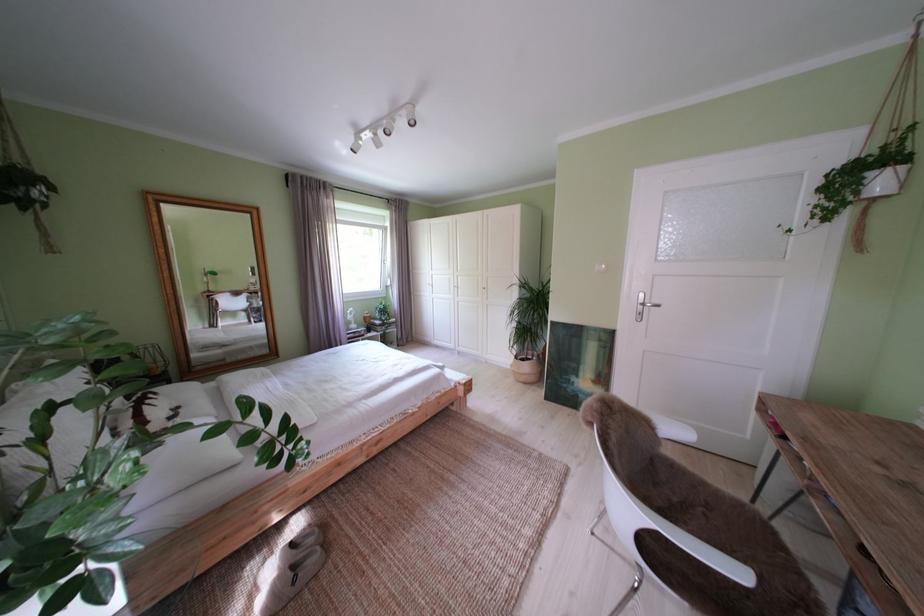
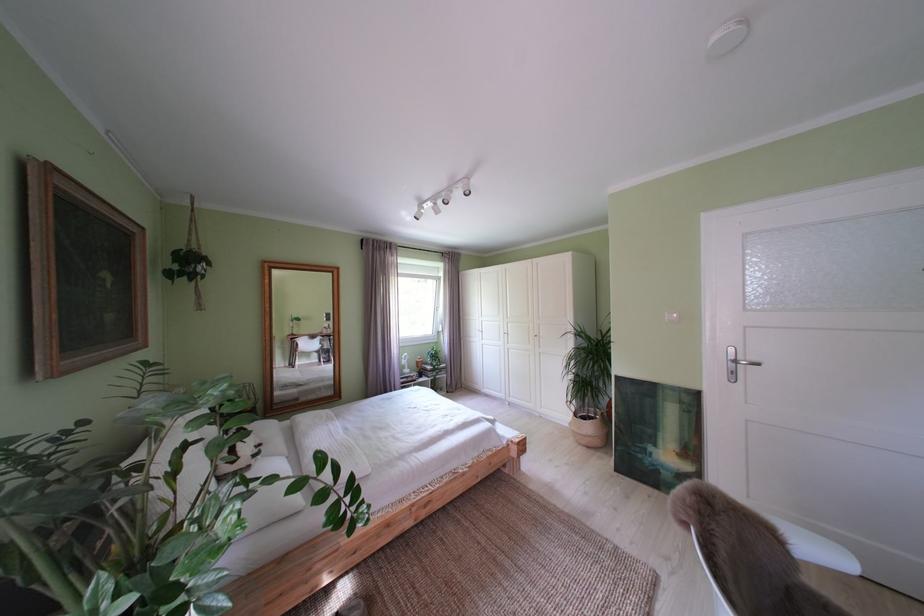
Find the pixel in the second image that matches (x=223, y=390) in the first image.

(298, 429)